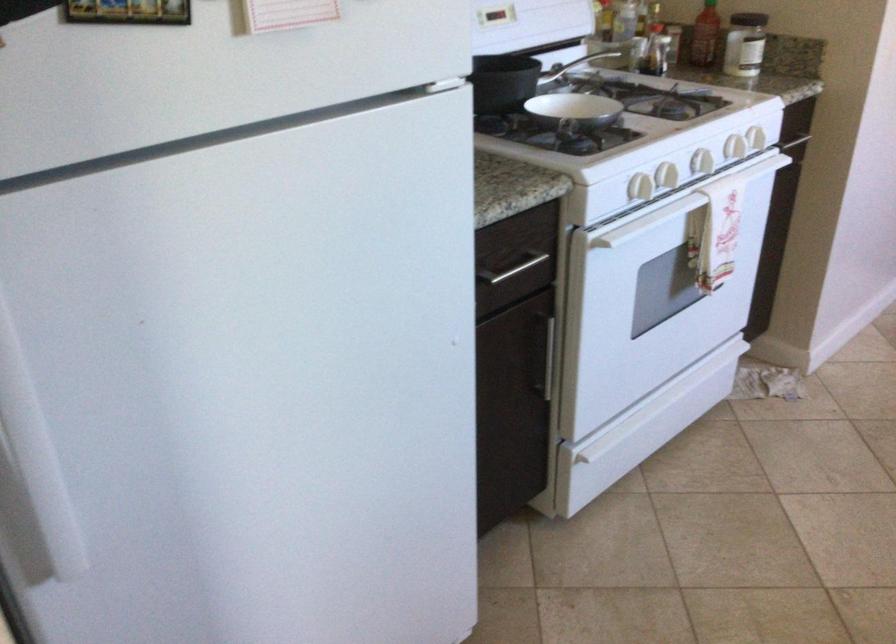
Question: How did the camera likely rotate?

Choices:
 (A) Left
 (B) Right
 (C) Up
 (D) Down

Answer: (C)